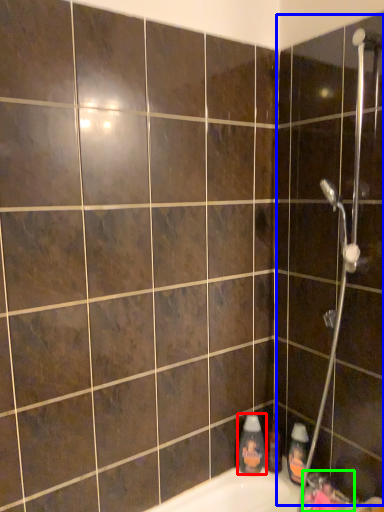
Question: Based on their relative distances, which object is nearer to cleaning product (highlighted by a red box)? Choose from screen door (highlighted by a blue box) and faucet (highlighted by a green box).

Choices:
 (A) screen door
 (B) faucet

Answer: (B)